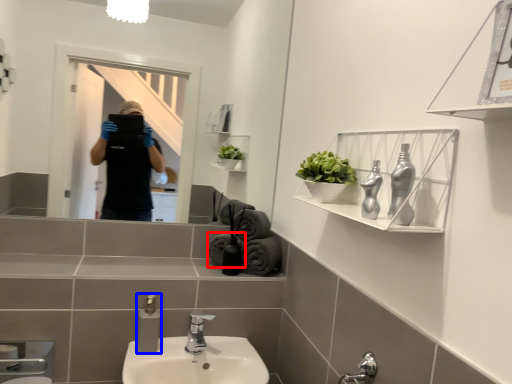
Question: Which point is further to the camera, bath towel (highlighted by a red box) or soap dispenser (highlighted by a blue box)?

Choices:
 (A) bath towel
 (B) soap dispenser

Answer: (A)